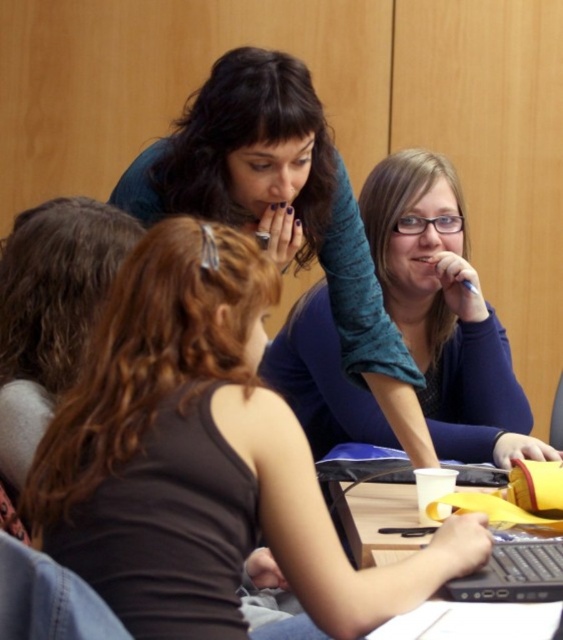
You are a tailor observing the two individuals at the table. You need to determine which of the two blue garments, the matte blue shirt at center or the matte blue sweater at center, would require less fabric to alter due to its size. Which one should you choose?

The matte blue shirt at center is shorter than the matte blue sweater at center, so it would require less fabric to alter due to its smaller size.

You are an interior designer observing the scene. You need to determine which object takes up more visual space in the image between the matte blue shirt at center and the matte blue sweater at center. Which one should you focus on for a design adjustment?

The matte blue sweater at center occupies more visual space than the matte blue shirt at center, so you should focus on the matte blue sweater at center for design adjustments.